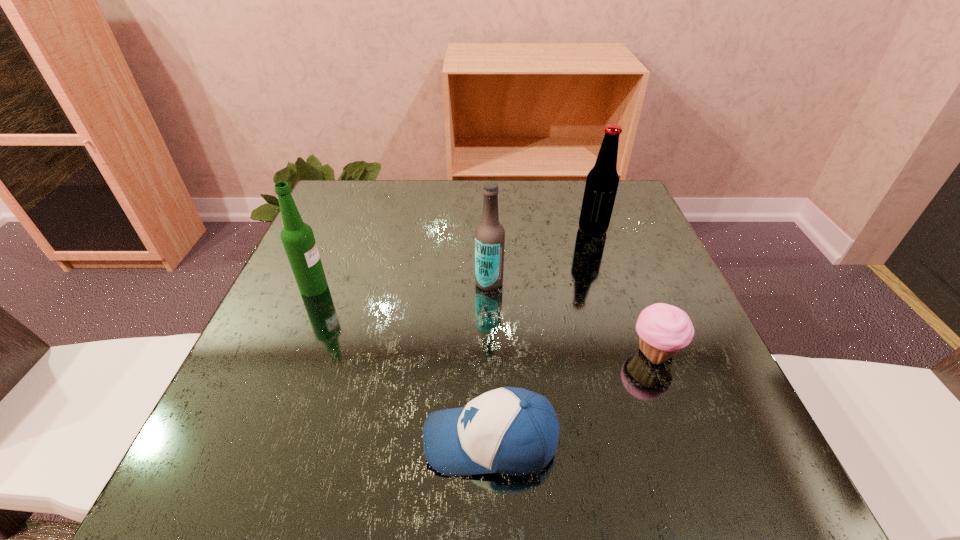
I want to click on object situated at the far right corner, so click(602, 181).

Where is `vacant space at the far edge`? The image size is (960, 540). vacant space at the far edge is located at coordinates (551, 200).

At what (x,y) coordinates should I click in order to perform the action: click on free space at the near edge of the desktop. Please return your answer as a coordinate pair (x, y). The image size is (960, 540). Looking at the image, I should click on (388, 471).

Where is `blank space at the left edge`? blank space at the left edge is located at coordinates (292, 295).

This screenshot has width=960, height=540. I want to click on vacant point at the right edge, so click(652, 366).

In the image, there is a desktop. Where is `vacant region at the far left corner`? The image size is (960, 540). vacant region at the far left corner is located at coordinates (344, 204).

At what (x,y) coordinates should I click in order to perform the action: click on free space at the near right corner of the desktop. Please return your answer as a coordinate pair (x, y). Image resolution: width=960 pixels, height=540 pixels. Looking at the image, I should click on (764, 469).

This screenshot has width=960, height=540. I want to click on free space between the leftmost object and the nearest object, so click(402, 364).

The height and width of the screenshot is (540, 960). Find the location of `blank region between the nearest object and the farthest beer bottle`. blank region between the nearest object and the farthest beer bottle is located at coordinates (541, 335).

Locate an element on the screen. Image resolution: width=960 pixels, height=540 pixels. vacant space that's between the leftmost beer bottle and the second beer bottle from left to right is located at coordinates (401, 285).